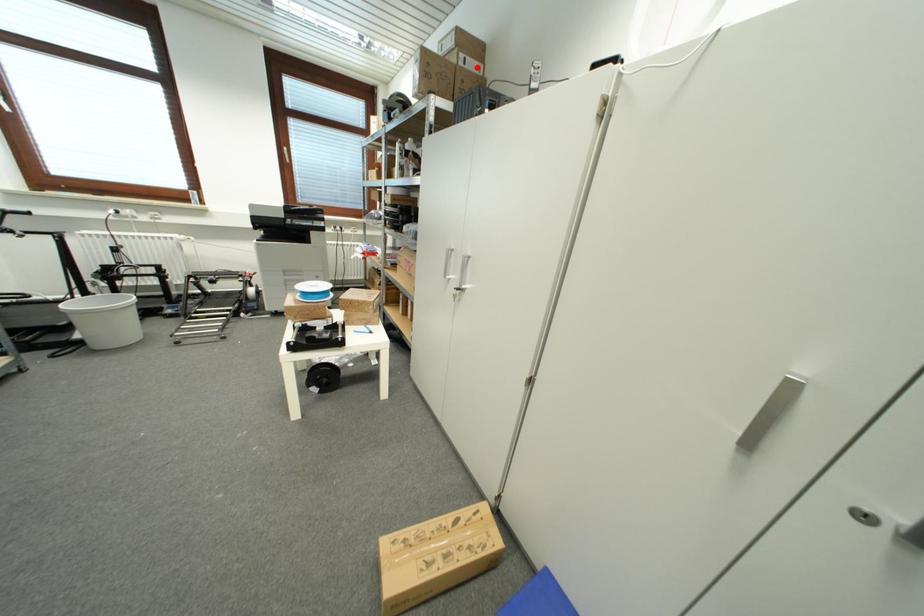
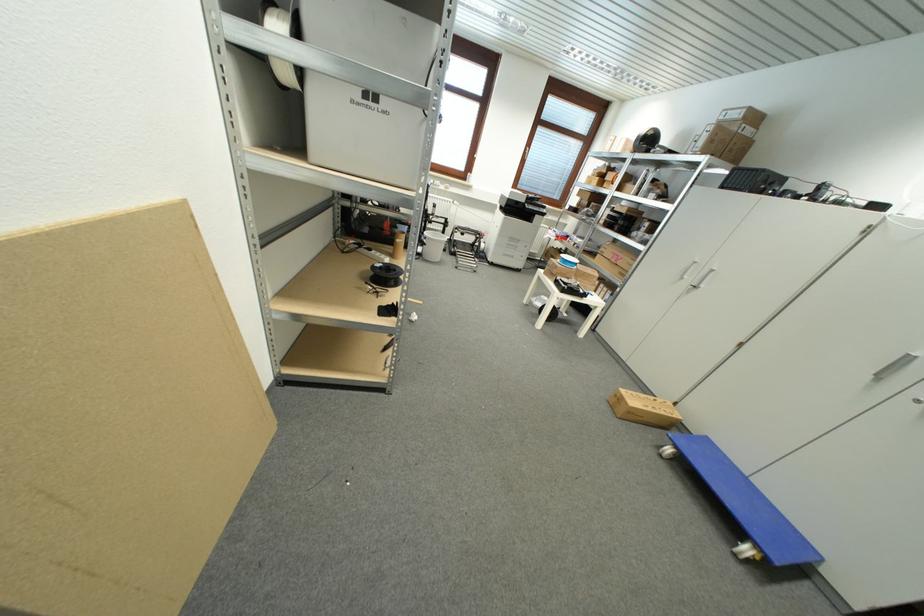
Locate, in the second image, the point that corresponds to the highlighted location in the first image.

(754, 134)